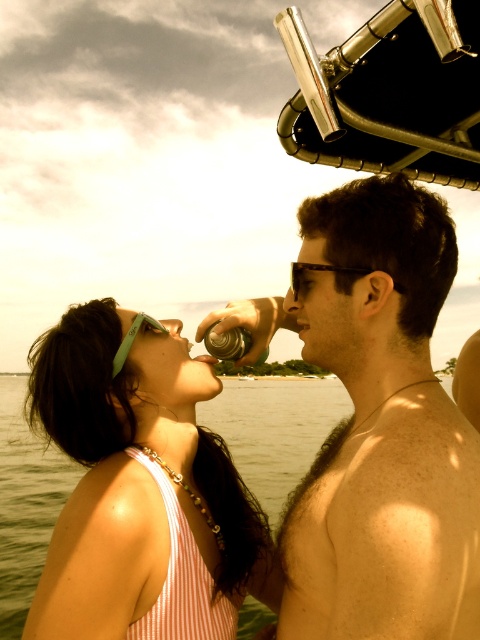
Which is more to the left, shiny metallic hair at right or matte pink tank top at center?

matte pink tank top at center

Is point (403, 433) farther from viewer compared to point (170, 456)?

That is False.

You are a GUI agent. You are given a task and a screenshot of the screen. Output one action in this format:
    pyautogui.click(x=<x>, y=<y>)
    Task: Click on the shiny metallic hair at right
    
    Given the screenshot: What is the action you would take?
    click(381, 428)

Looking at this image, measure the distance between matte pink tank top at center and metallic silver can at center.

matte pink tank top at center and metallic silver can at center are 37.63 inches apart.

Can you confirm if matte pink tank top at center is taller than metallic silver can at center?

Correct, matte pink tank top at center is much taller as metallic silver can at center.

This screenshot has height=640, width=480. I want to click on matte pink tank top at center, so click(134, 477).

Is shiny metallic hair at right positioned before clear water at center?

Yes, it is.

Does point (417, 381) come behind point (45, 493)?

No, (417, 381) is in front of (45, 493).

Which is behind, point (405, 228) or point (268, 477)?

Point (268, 477)

You are a GUI agent. You are given a task and a screenshot of the screen. Output one action in this format:
    pyautogui.click(x=<x>, y=<y>)
    Task: Click on the shiny metallic hair at right
    This screenshot has height=640, width=480.
    Given the screenshot: What is the action you would take?
    pyautogui.click(x=381, y=428)